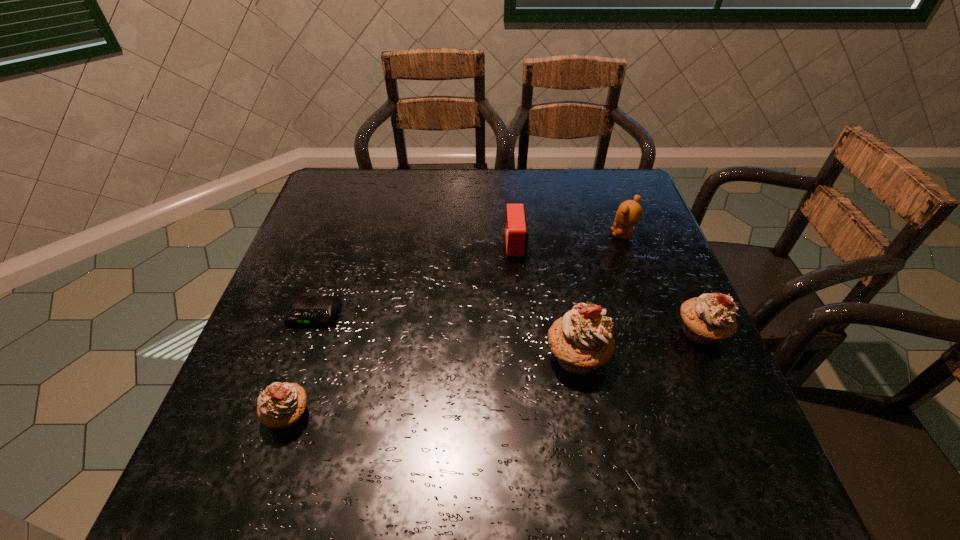
Identify the location of free space between the teddy bear and the tallest cupcake. The image size is (960, 540). (600, 296).

The image size is (960, 540). I want to click on vacant space in between the fifth object from left to right and the nearer alarm clock, so click(468, 275).

Identify which object is the second nearest to the nearest cupcake. Please provide its 2D coordinates. Your answer should be formatted as a tuple, i.e. [(x, y)], where the tuple contains the x and y coordinates of a point satisfying the conditions above.

[(582, 341)]

Locate an element on the screen. The image size is (960, 540). object identified as the fourth closest to the fourth object from left to right is located at coordinates (281, 405).

Locate which cupcake ranks second in proximity to the rightmost object. Please provide its 2D coordinates. Your answer should be formatted as a tuple, i.e. [(x, y)], where the tuple contains the x and y coordinates of a point satisfying the conditions above.

[(281, 405)]

Identify which cupcake is the third nearest to the nearer alarm clock. Please provide its 2D coordinates. Your answer should be formatted as a tuple, i.e. [(x, y)], where the tuple contains the x and y coordinates of a point satisfying the conditions above.

[(709, 318)]

Image resolution: width=960 pixels, height=540 pixels. Identify the location of vacant region that satisfies the following two spatial constraints: 1. on the display of the leftmost cupcake; 2. on the left side of the nearer alarm clock. (279, 414).

The image size is (960, 540). Find the location of `free location that satisfies the following two spatial constraints: 1. on the front-facing side of the taller alarm clock; 2. on the left side of the rightmost cupcake`. free location that satisfies the following two spatial constraints: 1. on the front-facing side of the taller alarm clock; 2. on the left side of the rightmost cupcake is located at coordinates 524,332.

Find the location of a particular element. vacant area that satisfies the following two spatial constraints: 1. on the front-facing side of the fourth object from left to right; 2. on the left side of the right alarm clock is located at coordinates (526, 356).

You are a GUI agent. You are given a task and a screenshot of the screen. Output one action in this format:
    pyautogui.click(x=<x>, y=<y>)
    Task: Click on the vacant area in the image that satisfies the following two spatial constraints: 1. on the face of the rightmost object; 2. on the right side of the teddy bear
    The height and width of the screenshot is (540, 960).
    Given the screenshot: What is the action you would take?
    pyautogui.click(x=658, y=332)